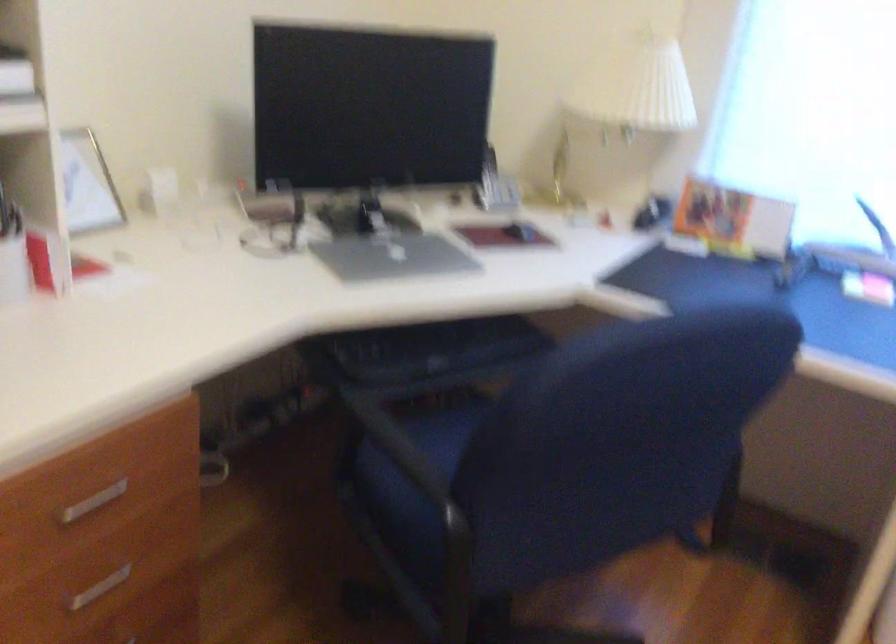
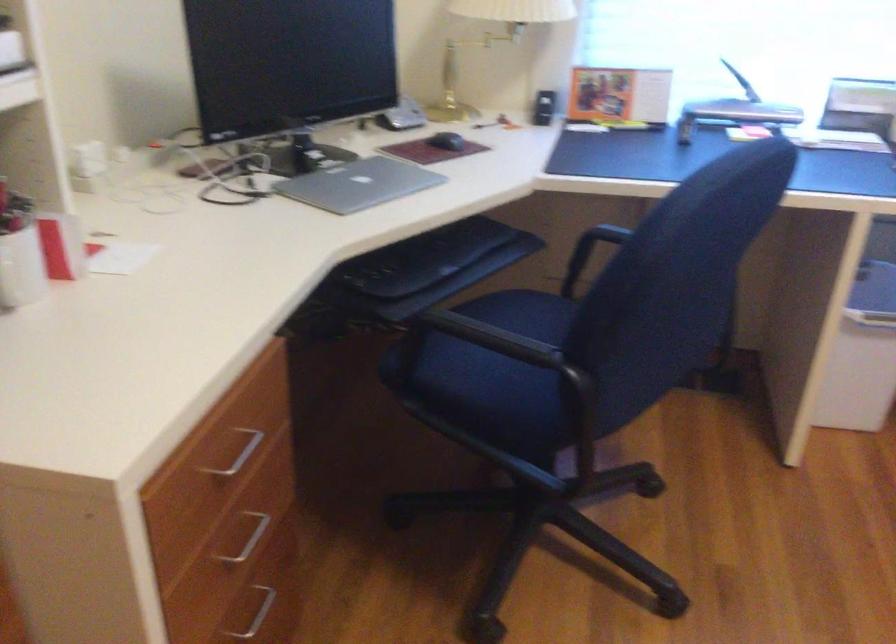
Find the pixel in the second image that matches point (385, 256) in the first image.

(358, 184)